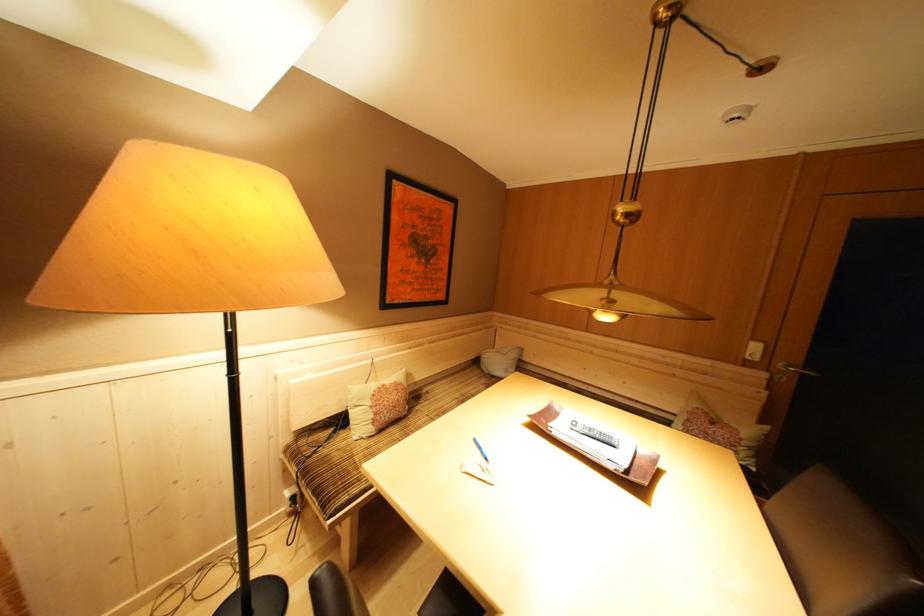
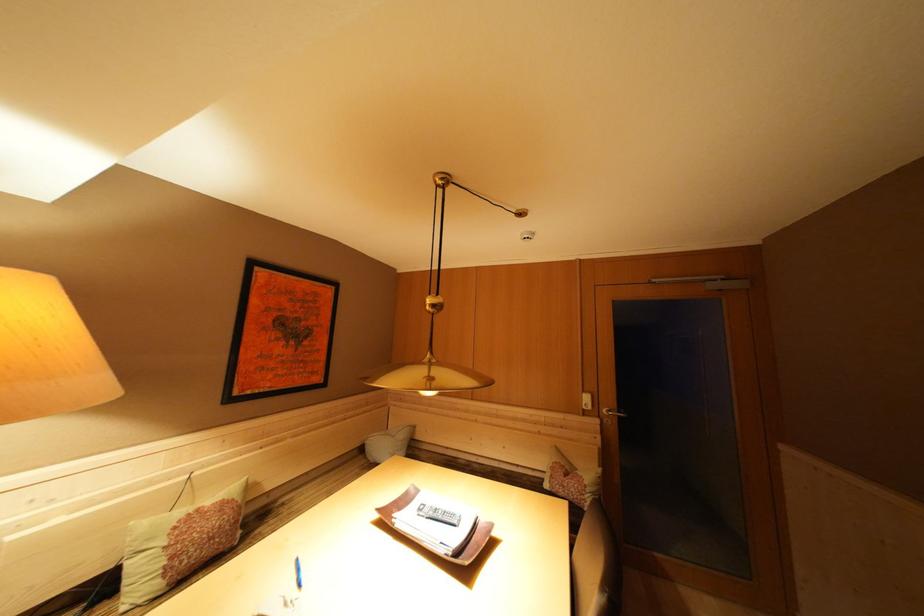
Where in the second image is the point corresponding to point (749, 440) from the first image?

(592, 487)